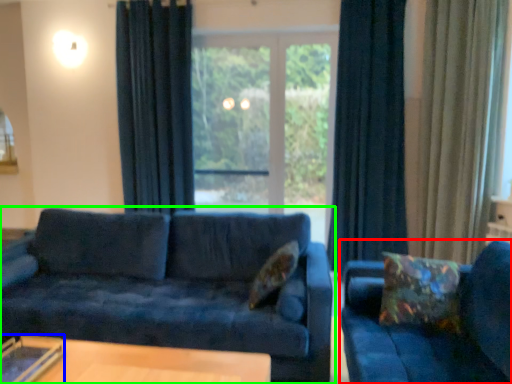
Question: Which is farther away from studio couch (highlighted by a red box)? glass table (highlighted by a blue box) or studio couch (highlighted by a green box)?

Choices:
 (A) glass table
 (B) studio couch

Answer: (A)